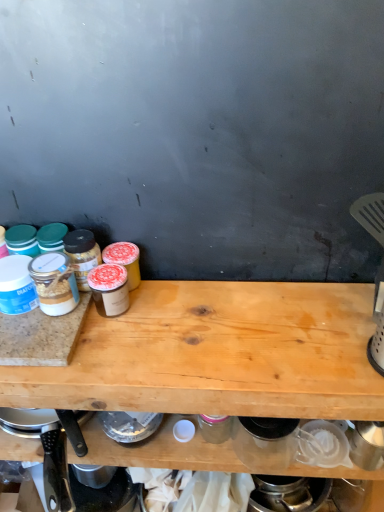
Identify the location of black plastic knife at lower left. (78, 482).

Which object is further away from the camera, granite cutting board at left or black plastic knife at lower left?

black plastic knife at lower left is more distant.

Is granite cutting board at left not near black plastic knife at lower left?

No, granite cutting board at left is in close proximity to black plastic knife at lower left.

From a real-world perspective, is granite cutting board at left physically above black plastic knife at lower left?

Yes.

Who is shorter, granite cutting board at left or black plastic knife at lower left?

granite cutting board at left is shorter.

Does black plastic knife at lower left have a lesser height compared to light brown wood at center?

Yes.

Between black plastic knife at lower left and light brown wood at center, which one has smaller width?

Thinner between the two is black plastic knife at lower left.

How much distance is there between black plastic knife at lower left and light brown wood at center?

The distance of black plastic knife at lower left from light brown wood at center is 13.13 inches.

Based on their positions, is black plastic knife at lower left located to the left or right of light brown wood at center?

In the image, black plastic knife at lower left appears on the left side of light brown wood at center.

Is light brown wood at center situated inside black plastic knife at lower left or outside?

light brown wood at center exists outside the volume of black plastic knife at lower left.

From the image's perspective, is light brown wood at center above or below black plastic knife at lower left?

light brown wood at center is above black plastic knife at lower left.

Based on the photo, from a real-world perspective, relative to black plastic knife at lower left, is light brown wood at center vertically above or below?

From a real-world perspective, light brown wood at center is physically above black plastic knife at lower left.

Would you say light brown wood at center is part of granite cutting board at left's contents?

No, light brown wood at center is not surrounded by granite cutting board at left.

Is granite cutting board at left far from light brown wood at center?

No, there isn't a large distance between granite cutting board at left and light brown wood at center.

Is the depth of granite cutting board at left greater than that of light brown wood at center?

Yes, it is.

Is light brown wood at center at the back of granite cutting board at left?

No, granite cutting board at left is not facing the opposite direction of light brown wood at center.

Which of these two, black plastic knife at lower left or granite cutting board at left, stands shorter?

granite cutting board at left.

Identify the location of appliance behind the granite cutting board at left. (78, 482).

Would you say black plastic knife at lower left is outside granite cutting board at left?

Yes, black plastic knife at lower left is outside of granite cutting board at left.

From a real-world perspective, is light brown wood at center located higher than granite cutting board at left?

No, from a real-world perspective, light brown wood at center is not on top of granite cutting board at left.

Is light brown wood at center to the right of granite cutting board at left from the viewer's perspective?

Indeed, light brown wood at center is positioned on the right side of granite cutting board at left.

Where is `table below the granite cutting board at left (from the image's perspective)`? The height and width of the screenshot is (512, 384). table below the granite cutting board at left (from the image's perspective) is located at coordinates (219, 354).

Considering the sizes of objects light brown wood at center and granite cutting board at left in the image provided, who is taller, light brown wood at center or granite cutting board at left?

light brown wood at center is taller.

Find the location of a particular element. The height and width of the screenshot is (512, 384). cutting board above the black plastic knife at lower left (from the image's perspective) is located at coordinates (41, 336).

I want to click on appliance behind the light brown wood at center, so click(78, 482).

Looking at the image, which one is located further to black plastic knife at lower left, granite cutting board at left or light brown wood at center?

light brown wood at center is positioned further to the anchor black plastic knife at lower left.

From the image, which object appears to be farther from black plastic knife at lower left, light brown wood at center or granite cutting board at left?

light brown wood at center.

Based on their spatial positions, is granite cutting board at left or black plastic knife at lower left closer to light brown wood at center?

Based on the image, granite cutting board at left appears to be nearer to light brown wood at center.

Based on their spatial positions, is black plastic knife at lower left or granite cutting board at left closer to light brown wood at center?

Among the two, granite cutting board at left is located nearer to light brown wood at center.

Looking at the image, which one is located further to granite cutting board at left, light brown wood at center or black plastic knife at lower left?

black plastic knife at lower left lies further to granite cutting board at left than the other object.

When comparing their distances from granite cutting board at left, does black plastic knife at lower left or light brown wood at center seem further?

black plastic knife at lower left is further to granite cutting board at left.

Locate an element on the screen. This screenshot has height=512, width=384. table between granite cutting board at left and black plastic knife at lower left in the up-down direction is located at coordinates click(219, 354).